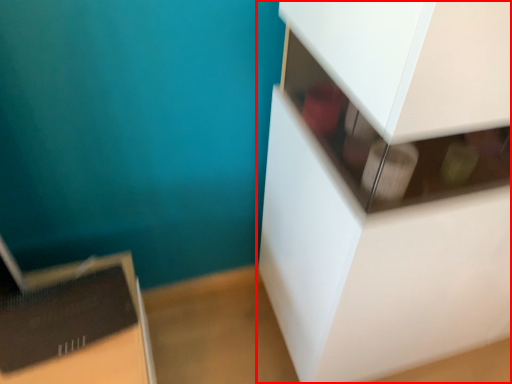
Question: Considering the relative positions of furniture (annotated by the red box) and cardboard box in the image provided, where is furniture (annotated by the red box) located with respect to the staircase?

Choices:
 (A) left
 (B) right

Answer: (B)